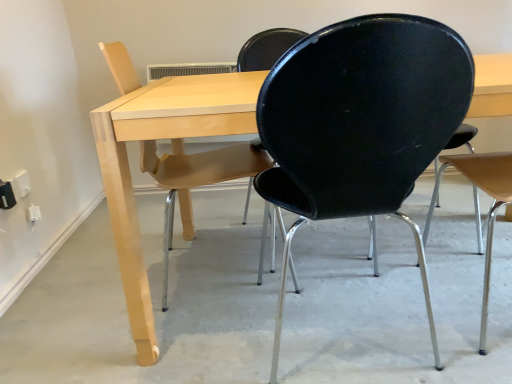
This screenshot has height=384, width=512. I want to click on empty space that is in between black plastic chair at center, arranged as the second chair when viewed from the right, and matte wood chair at left, the 3th chair positioned from the right, so click(255, 308).